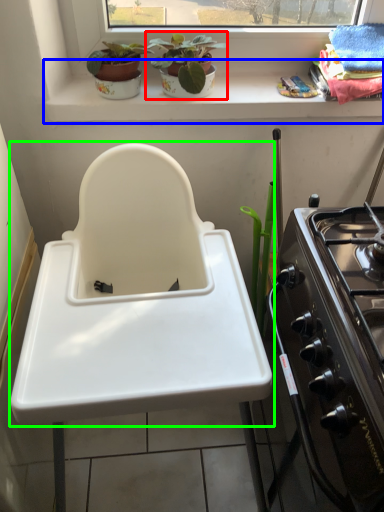
Question: Which is nearer to the houseplant (highlighted by a red box)? window sill (highlighted by a blue box) or sink (highlighted by a green box).

Choices:
 (A) window sill
 (B) sink

Answer: (A)